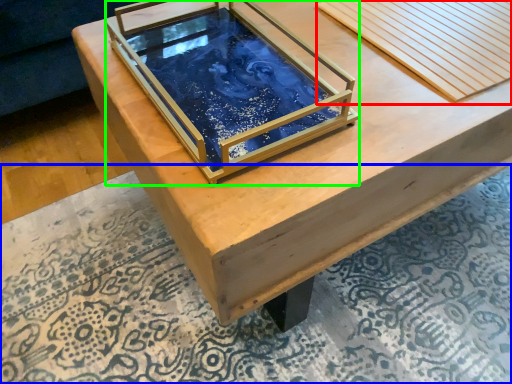
Question: Considering the real-world distances, which object is closest to plank (highlighted by a red box)? mat (highlighted by a blue box) or glass box (highlighted by a green box).

Choices:
 (A) mat
 (B) glass box

Answer: (B)